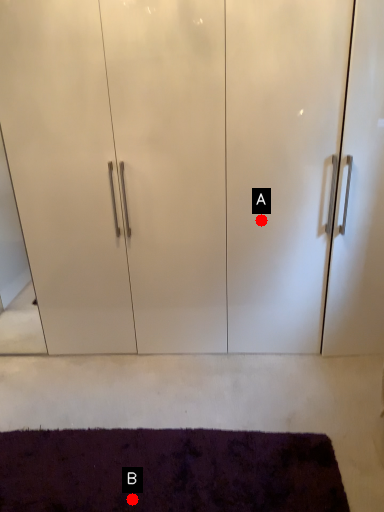
Question: Two points are circled on the image, labeled by A and B beside each circle. Which point is farther from the camera taking this photo?

Choices:
 (A) A is further
 (B) B is further

Answer: (A)